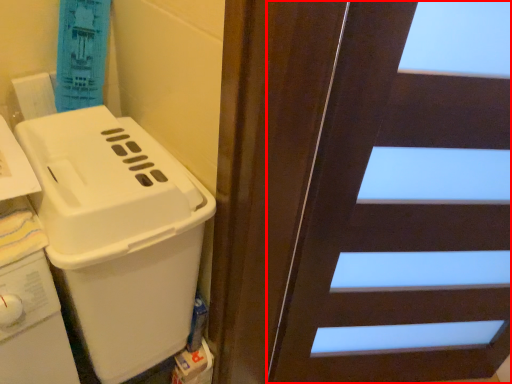
Question: Considering the relative positions of door (annotated by the red box) and appliance in the image provided, where is door (annotated by the red box) located with respect to the staircase?

Choices:
 (A) left
 (B) right

Answer: (B)